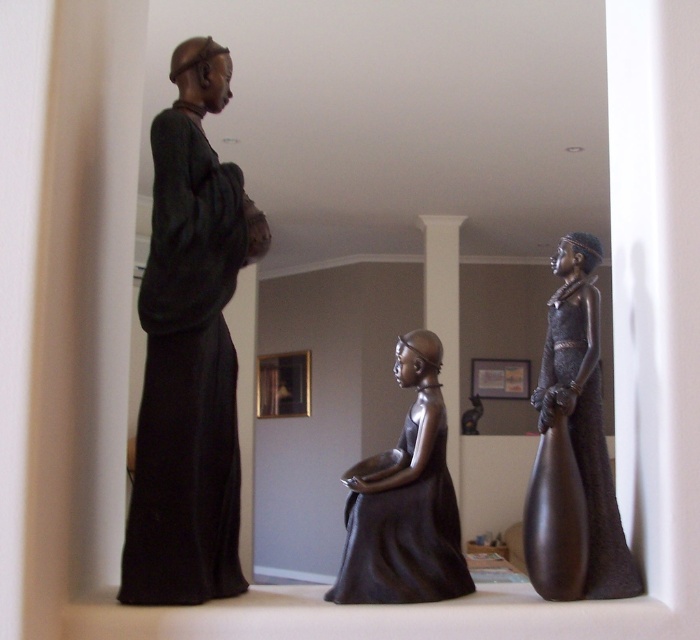
Question: Which point is closer to the camera?

Choices:
 (A) shiny dark brown dress at right
 (B) matte black robe at left
 (C) matte black statue at center

Answer: (B)

Question: Which object appears farthest from the camera in this image?

Choices:
 (A) matte black robe at left
 (B) matte black statue at center
 (C) shiny dark brown dress at right

Answer: (C)

Question: Which object is the closest to the matte black robe at left?

Choices:
 (A) matte black statue at center
 (B) shiny dark brown dress at right

Answer: (A)

Question: Is matte black robe at left thinner than shiny dark brown dress at right?

Choices:
 (A) no
 (B) yes

Answer: (B)

Question: Does matte black robe at left appear under shiny dark brown dress at right?

Choices:
 (A) no
 (B) yes

Answer: (A)

Question: Does matte black statue at center have a smaller size compared to shiny dark brown dress at right?

Choices:
 (A) yes
 (B) no

Answer: (B)